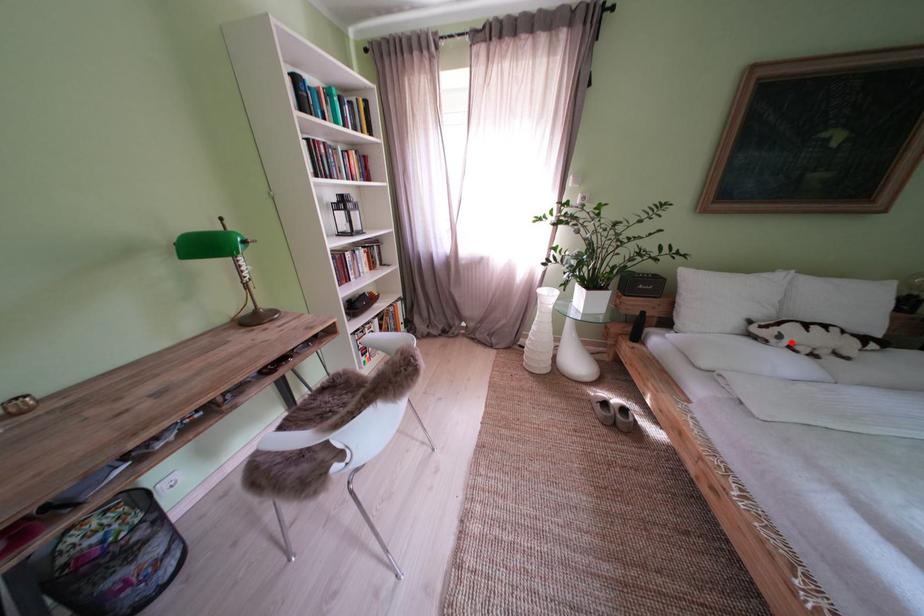
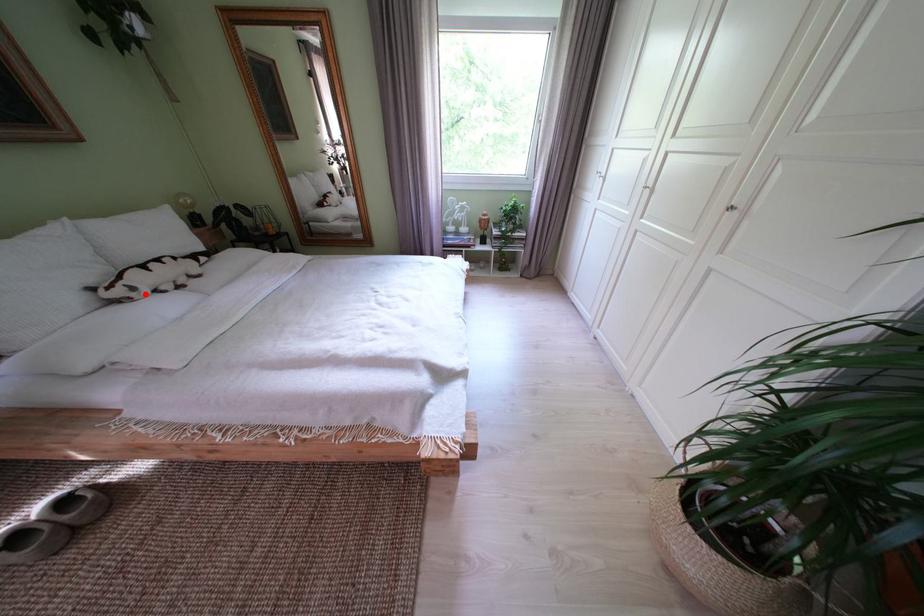
I am providing you with two images of the same scene from different viewpoints. A red point is marked on the first image and another point is marked on the second image. Do the highlighted points in image1 and image2 indicate the same real-world spot?

Yes